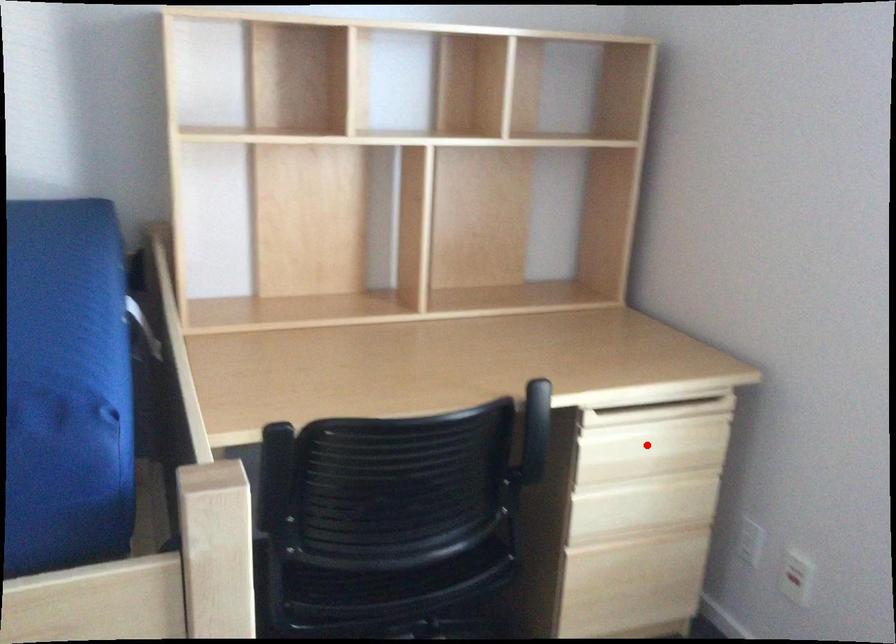
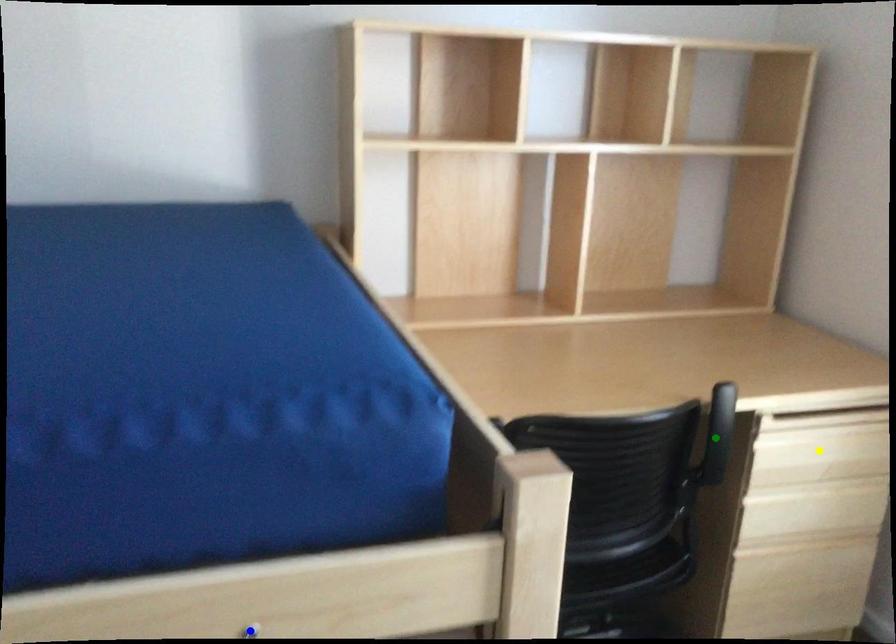
Question: I am providing you with two images of the same scene from different viewpoints. A red point is marked on the first image. You are given multiple points on the second image. Can you choose the point in image 2 that corresponds to the point in image 1?

Choices:
 (A) green point
 (B) blue point
 (C) yellow point

Answer: (C)